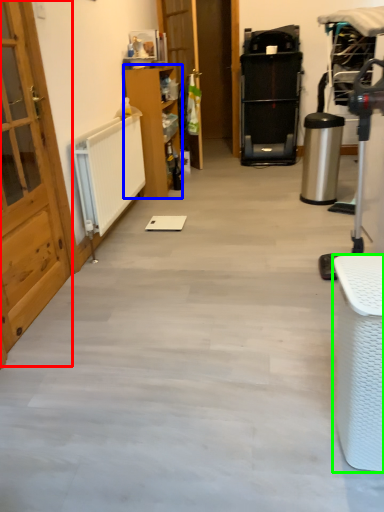
Question: Which object is positioned closest to door (highlighted by a red box)? Select from furniture (highlighted by a blue box) and furniture (highlighted by a green box).

Choices:
 (A) furniture
 (B) furniture

Answer: (B)